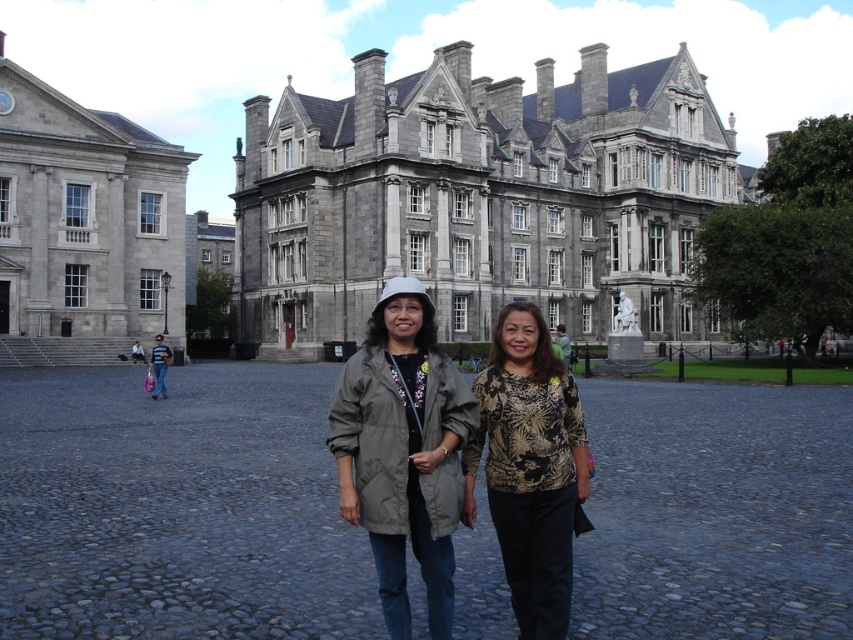
You are a photographer standing 10 feet away from the gray stone building at center. You want to take a photo of the matte gray coat at center without the building in the frame. Is the distance between them sufficient for you to move back and still capture the coat while excluding the building?

The gray stone building at center and matte gray coat at center are 102.56 feet apart. Since you are only 10 feet away from the building, moving back would not be possible as the distance between them is large enough to allow positioning where the building is out of frame. However, your current position is too close to the building. To exclude the building, you need to move further away from the building so that the coat is in frame and the building is not. The 102.56 feet gap allows this possibility if you

You are standing in front of the grand historic building and want to take a photo of the gray stone building at left. The photographer tells you that the optimal framing requires the building to be centered at point (84,227). Are you currently positioned correctly to capture this?

Yes, because the gray stone building at left is located at point (84,227), so the building is already centered at the required coordinates.